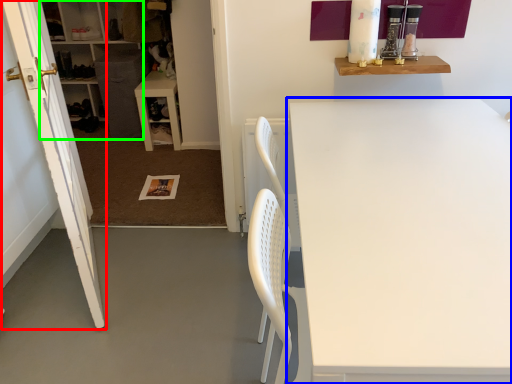
Question: Which object is positioned closest to door (highlighted by a red box)? Select from table (highlighted by a blue box) and cabinetry (highlighted by a green box).

Choices:
 (A) table
 (B) cabinetry

Answer: (A)